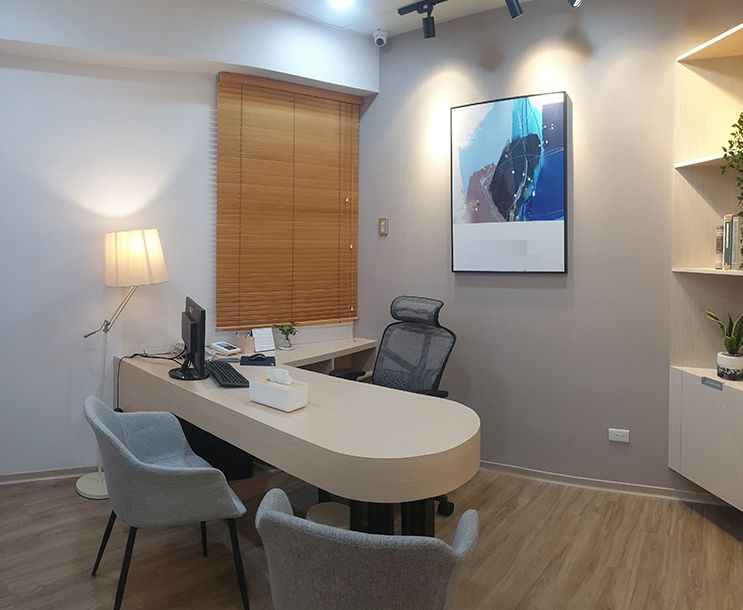
You are a GUI agent. You are given a task and a screenshot of the screen. Output one action in this format:
    pyautogui.click(x=<x>, y=<y>)
    Task: Click on the floor
    The height and width of the screenshot is (610, 743).
    Given the screenshot: What is the action you would take?
    pyautogui.click(x=573, y=504)